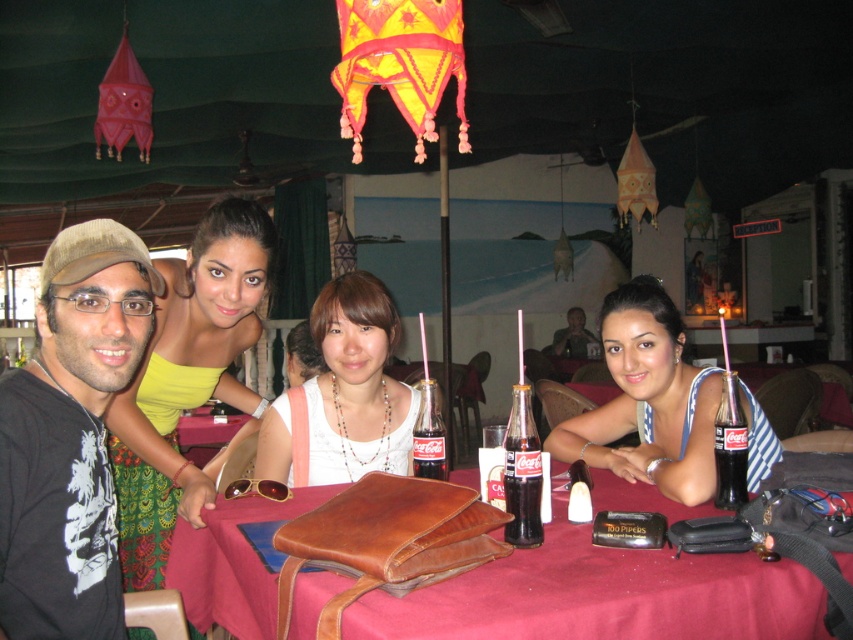
Which is more to the right, blue striped dress at table right or translucent glass coca-cola bottle at center?

From the viewer's perspective, blue striped dress at table right appears more on the right side.

Is blue striped dress at table right further to the viewer compared to translucent glass coca-cola bottle at center?

Yes, blue striped dress at table right is further from the viewer.

Where is `blue striped dress at table right`? The width and height of the screenshot is (853, 640). blue striped dress at table right is located at coordinates (648, 401).

Is brown leather bag at center below coca-cola glass bottle at table right?

Indeed, brown leather bag at center is positioned under coca-cola glass bottle at table right.

Which of these two, brown leather bag at center or coca-cola glass bottle at table right, stands taller?

brown leather bag at center is taller.

Does point (231, 525) come behind point (720, 401)?

No, it is not.

Identify the location of brown leather bag at center. (602, 595).

Who is positioned more to the right, yellow-green fabric dress at upper left or black glass coca-cola bottle at table center?

Positioned to the right is black glass coca-cola bottle at table center.

Is yellow-green fabric dress at upper left below black glass coca-cola bottle at table center?

No.

Between point (251, 224) and point (538, 481), which one is positioned in front?

Point (538, 481) is in front.

The height and width of the screenshot is (640, 853). Find the location of `yellow-green fabric dress at upper left`. yellow-green fabric dress at upper left is located at coordinates (186, 380).